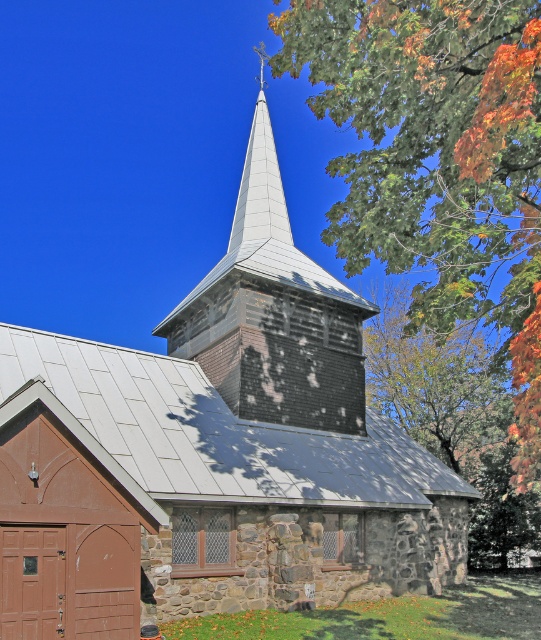
In the scene shown: You are standing in front of the church and want to know how far the point at coordinates point (324,3) is from you. Can you determine the distance?

The point point (324,3) is 19.41 meters away from the camera, so the distance is 19.41 meters.

You are standing in front of the church and notice a specific point marked at coordinates point (273,314). What object is located at that point?

The weathered wood steeple at center is located at point (273,314).

You are an architect analyzing the church structure. You need to determine which part of the church has a greater horizontal span. Based on the image, which is wider between the weathered wood steeple at center and the white metallic spire at upper center?

The weathered wood steeple at center is wider than the white metallic spire at upper center.